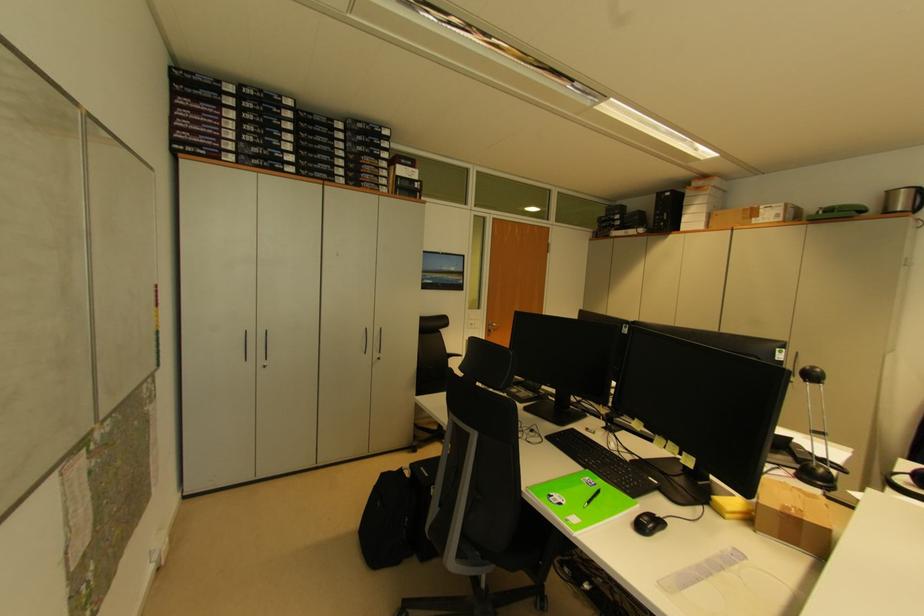
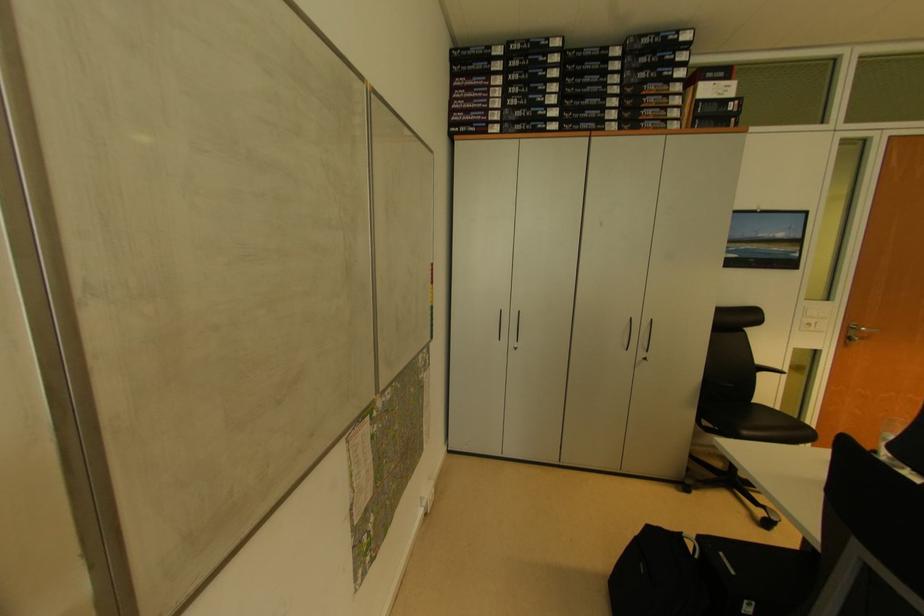
In the second image, find the point that corresponds to point (404, 471) in the first image.

(684, 536)